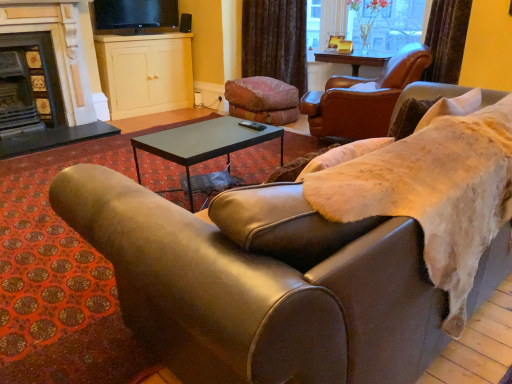
Question: From the image's perspective, is velvet brown curtain at upper center located above or below leather couch at center?

Choices:
 (A) below
 (B) above

Answer: (B)

Question: Would you say velvet brown curtain at upper center is inside or outside leather couch at center?

Choices:
 (A) outside
 (B) inside

Answer: (A)

Question: Estimate the real-world distances between objects in this image. Which object is farther from the leather armchair at upper right?

Choices:
 (A) matte tiled fireplace at left, which is counted as the second fireplace, starting from the right
 (B) black glossy tv at upper center
 (C) black metal coffee table at center
 (D) dark gray stone fireplace at left, marked as the second fireplace in a left-to-right arrangement
 (E) velvet pink swivel chair at center

Answer: (A)

Question: Which is nearer to the black glossy tv at upper center?

Choices:
 (A) matte tiled fireplace at left, positioned as the first fireplace in left-to-right order
 (B) leather couch at center
 (C) dark gray stone fireplace at left, marked as the second fireplace in a left-to-right arrangement
 (D) matte cream cabinet at upper center
 (E) velvet pink swivel chair at center

Answer: (D)